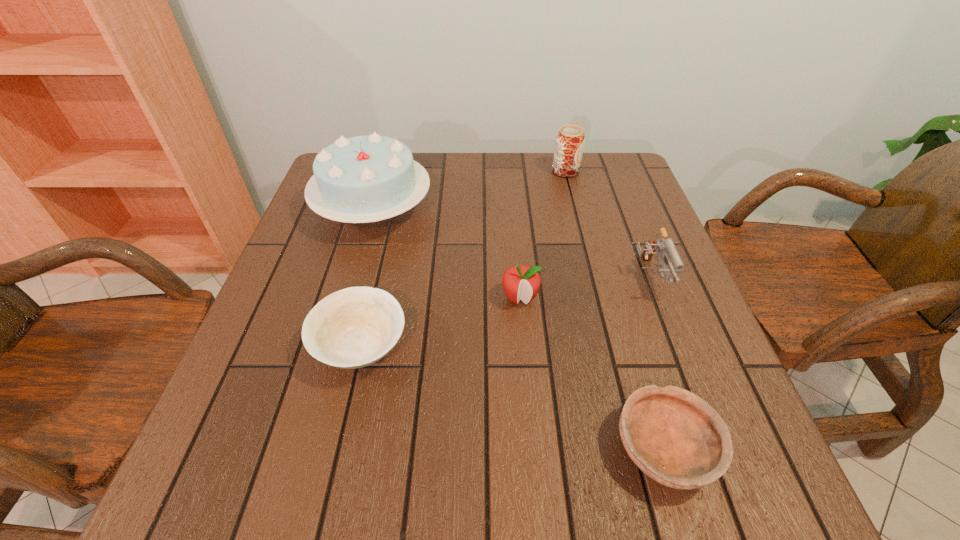
Identify the location of the tallest object. The image size is (960, 540). (361, 179).

Locate an element on the screen. Image resolution: width=960 pixels, height=540 pixels. beer can is located at coordinates (570, 140).

What are the coordinates of `gun` in the screenshot? It's located at (666, 247).

Image resolution: width=960 pixels, height=540 pixels. Find the location of `the third object from left to right`. the third object from left to right is located at coordinates (522, 282).

Locate an element on the screen. The width and height of the screenshot is (960, 540). apple is located at coordinates (522, 282).

Where is `the farther bowl`? The image size is (960, 540). the farther bowl is located at coordinates (354, 327).

Locate an element on the screen. Image resolution: width=960 pixels, height=540 pixels. the nearest object is located at coordinates (676, 438).

Image resolution: width=960 pixels, height=540 pixels. Identify the location of the shortest object. pyautogui.click(x=676, y=438).

In order to click on vacant area situated on the front of the tallest object in this screenshot , I will do `click(337, 339)`.

At what (x,y) coordinates should I click in order to perform the action: click on free point located on the front of the beer can. Please return your answer as a coordinate pair (x, y). This screenshot has height=540, width=960. Looking at the image, I should click on (575, 206).